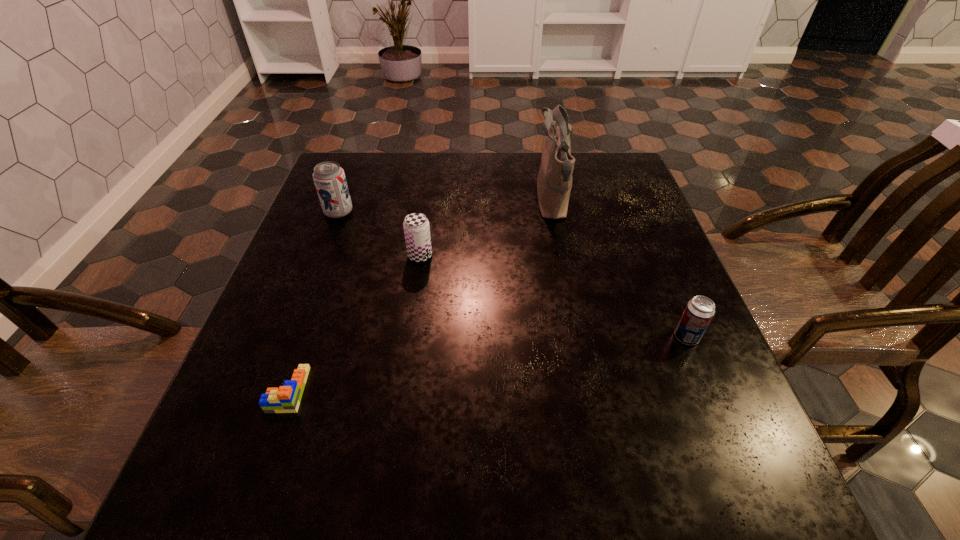
This screenshot has height=540, width=960. Identify the location of the tallest object. (554, 182).

Find the location of a particular element. This screenshot has height=540, width=960. the second object from right to left is located at coordinates (554, 182).

The image size is (960, 540). I want to click on the fourth shortest object, so click(329, 178).

Image resolution: width=960 pixels, height=540 pixels. What are the coordinates of `the leftmost beer can` in the screenshot? It's located at (329, 178).

The width and height of the screenshot is (960, 540). Identify the location of the third object from right to left. (416, 227).

At what (x,y) coordinates should I click in order to perform the action: click on the third nearest object. Please return your answer as a coordinate pair (x, y). This screenshot has width=960, height=540. Looking at the image, I should click on (416, 227).

You are a GUI agent. You are given a task and a screenshot of the screen. Output one action in this format:
    pyautogui.click(x=<x>, y=<y>)
    Task: Click on the rightmost object
    The image size is (960, 540).
    Given the screenshot: What is the action you would take?
    pyautogui.click(x=699, y=311)

Identify the location of the rightmost beer can. Image resolution: width=960 pixels, height=540 pixels. (699, 311).

I want to click on the nearest object, so click(286, 399).

Locate an element on the screen. Image resolution: width=960 pixels, height=540 pixels. Lego is located at coordinates (286, 399).